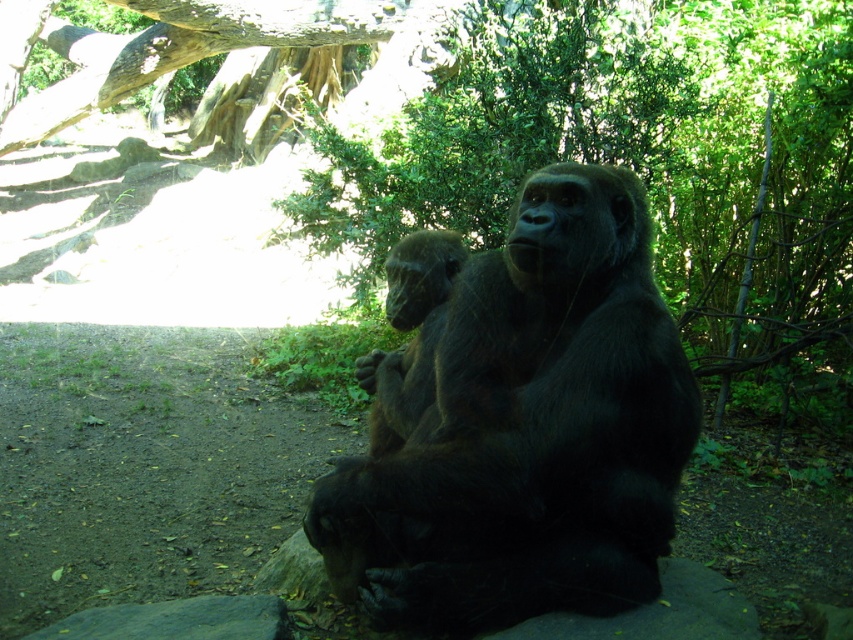
You are a wildlife photographer trying to capture a photo of the dark brown fur gorilla at center. You notice a rough bark tree trunk at upper left in the background. Based on their sizes, which one would appear wider in your photo?

The rough bark tree trunk at upper left would appear wider in the photo because the dark brown fur gorilla at center is narrower than the rough bark tree trunk at upper left.

You are a visitor at the zoo and want to take a photo of the dark brown fur gorilla at center without any obstructions. The green leafy tree at upper center is in the way. Can you move to a different angle where the tree does not block the view of the gorilla?

The green leafy tree at upper center is bigger than the dark brown fur gorilla at center, so moving to a lower angle or position where the tree is out of frame might allow you to capture the gorilla without obstruction.